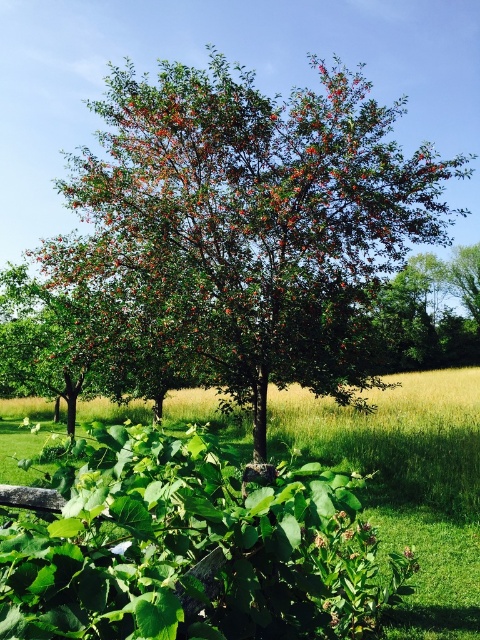
Question: From the image, what is the correct spatial relationship of green leafy tree at center in relation to green leafy bush at center?

Choices:
 (A) right
 (B) left

Answer: (B)

Question: Considering the real-world distances, which object is closest to the white matte flower at center?

Choices:
 (A) green leafy bush at center
 (B) green leafy tree at center

Answer: (B)

Question: Which object is positioned farthest from the green leafy tree at center?

Choices:
 (A) white matte flower at center
 (B) green leafy bush at center

Answer: (A)

Question: Estimate the real-world distances between objects in this image. Which object is closer to the white matte flower at center?

Choices:
 (A) green leafy bush at center
 (B) green leafy tree at center

Answer: (B)

Question: In this image, where is green leafy bush at center located relative to white matte flower at center?

Choices:
 (A) left
 (B) right

Answer: (B)

Question: Can you confirm if green leafy tree at center is thinner than green leafy bush at center?

Choices:
 (A) no
 (B) yes

Answer: (B)